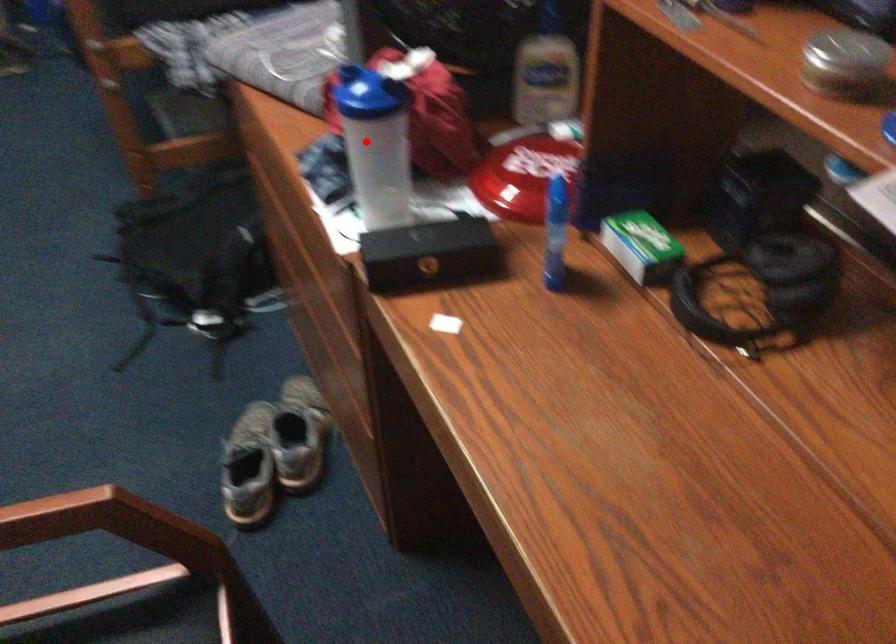
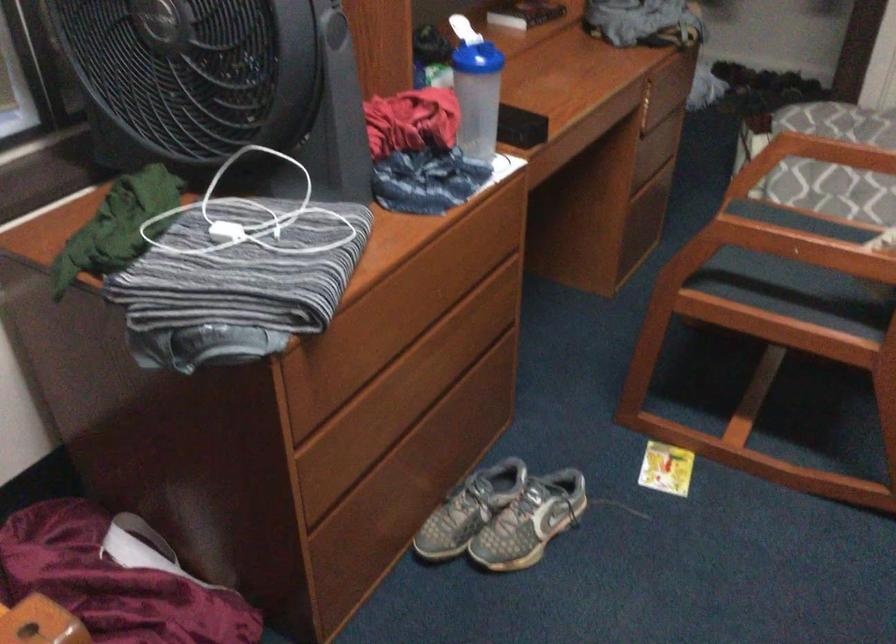
Where in the second image is the point corresponding to the highlighted location from the first image?

(478, 97)